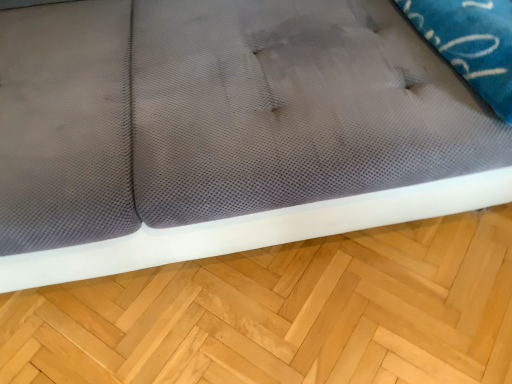
Question: Do you think white mesh pillow at upper right is within light brown wood at lower center, or outside of it?

Choices:
 (A) inside
 (B) outside

Answer: (B)

Question: Looking at their shapes, would you say white mesh pillow at upper right is wider or thinner than light brown wood at lower center?

Choices:
 (A) wide
 (B) thin

Answer: (A)

Question: In the image, is white mesh pillow at upper right positioned in front of or behind light brown wood at lower center?

Choices:
 (A) behind
 (B) front

Answer: (B)

Question: From the image's perspective, is light brown wood at lower center positioned above or below white mesh pillow at upper right?

Choices:
 (A) above
 (B) below

Answer: (B)

Question: Looking at the image, does light brown wood at lower center seem bigger or smaller compared to white mesh pillow at upper right?

Choices:
 (A) small
 (B) big

Answer: (B)

Question: Is light brown wood at lower center situated inside white mesh pillow at upper right or outside?

Choices:
 (A) outside
 (B) inside

Answer: (A)

Question: Considering their positions, is light brown wood at lower center located in front of or behind white mesh pillow at upper right?

Choices:
 (A) front
 (B) behind

Answer: (B)